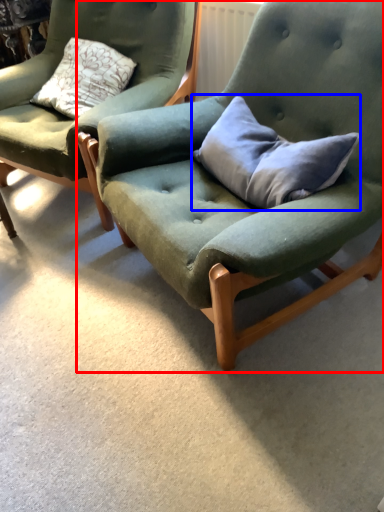
Question: Which object is closer to the camera taking this photo, chair (highlighted by a red box) or pillow (highlighted by a blue box)?

Choices:
 (A) chair
 (B) pillow

Answer: (A)